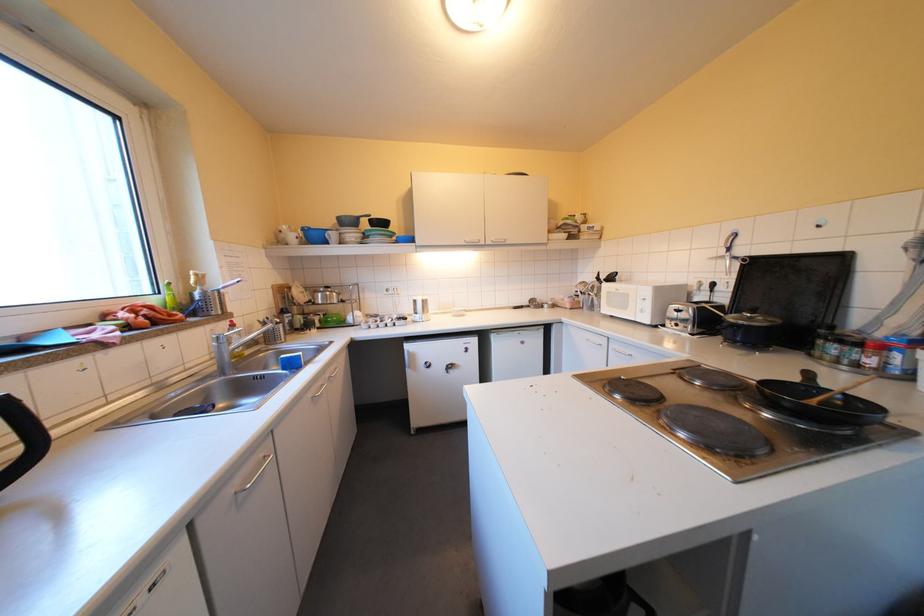
Find the location of a particular element. faucet handle is located at coordinates (232, 347).